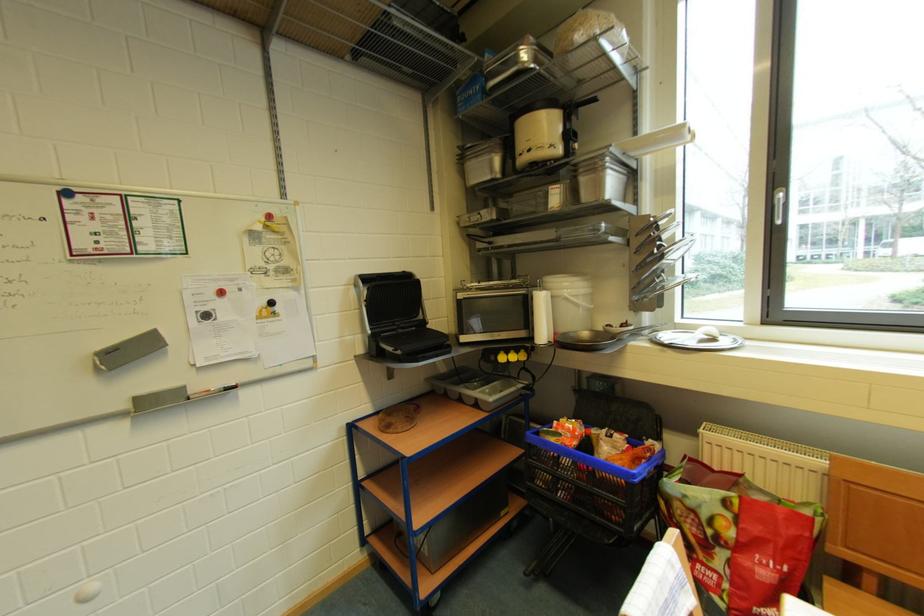
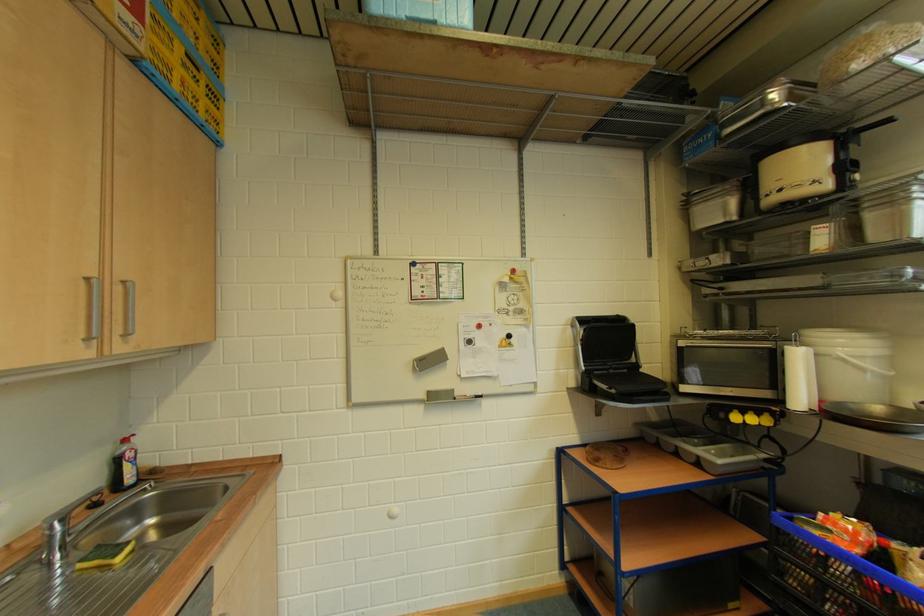
Where in the second image is the point corresponding to the point at 548,302 from the first image?

(805, 359)